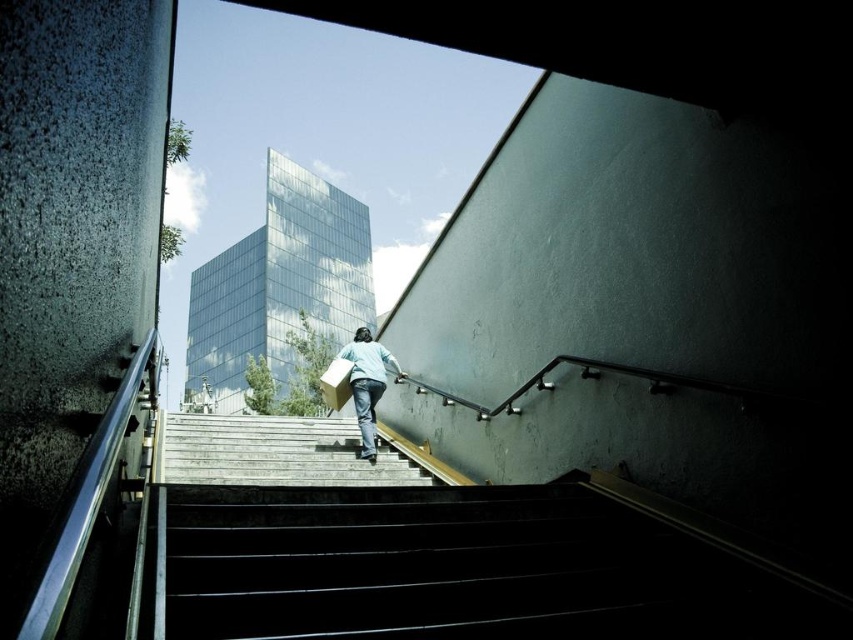
Question: In this image, where is wooden stairs at center located relative to light blue fabric at center?

Choices:
 (A) below
 (B) above

Answer: (A)

Question: Is wooden stairs at center below light blue fabric at center?

Choices:
 (A) yes
 (B) no

Answer: (A)

Question: Which point is farther to the camera?

Choices:
 (A) light blue fabric at center
 (B) wooden stairs at center

Answer: (A)

Question: Among these points, which one is nearest to the camera?

Choices:
 (A) (259, 460)
 (B) (376, 384)

Answer: (A)

Question: Is wooden stairs at center to the right of light blue fabric at center from the viewer's perspective?

Choices:
 (A) yes
 (B) no

Answer: (B)